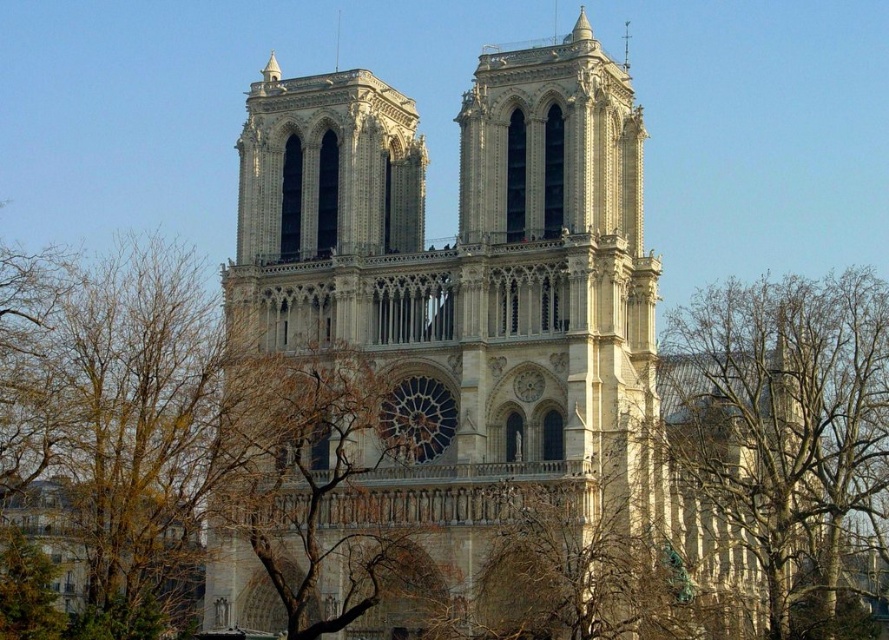
Is stone cathedral at center positioned in front of bare branches at right?

Yes, stone cathedral at center is in front of bare branches at right.

Which is below, stone cathedral at center or bare branches at right?

Positioned lower is bare branches at right.

The width and height of the screenshot is (889, 640). I want to click on stone cathedral at center, so click(459, 272).

Is stone cathedral at center taller than brown leafy tree at left?

Correct, stone cathedral at center is much taller as brown leafy tree at left.

Does point (242, 140) come behind point (45, 436)?

Yes, it is behind point (45, 436).

Find the location of a particular element. stone cathedral at center is located at coordinates (459, 272).

Is stone cathedral at center wider than brown leafless branches at center?

Yes.

Who is more forward, (343,500) or (403,433)?

Point (343,500) is more forward.

At what (x,y) coordinates should I click in order to perform the action: click on stone cathedral at center. Please return your answer as a coordinate pair (x, y). Looking at the image, I should click on (459, 272).